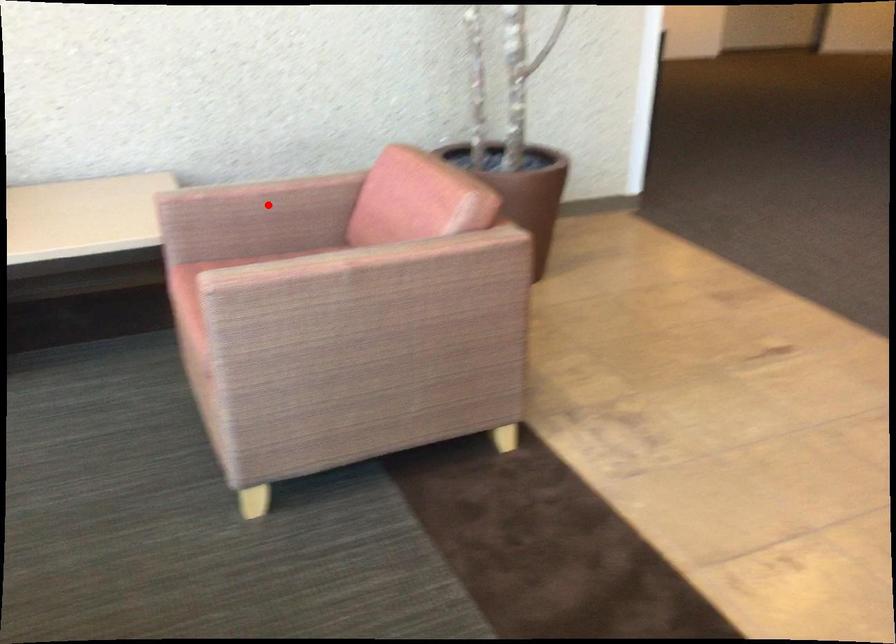
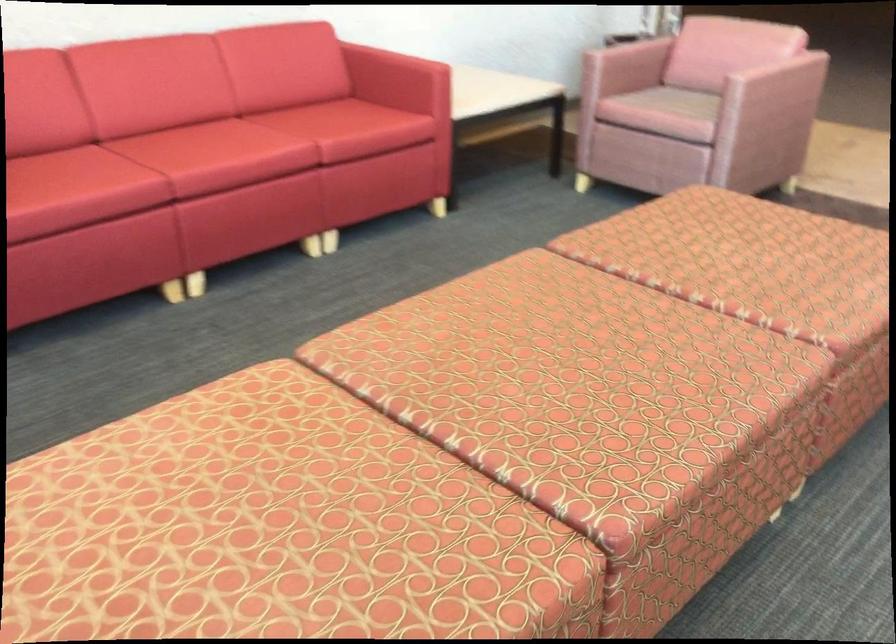
Question: I am providing you with two images of the same scene from different viewpoints. A red point is marked on the first image. At the location where the point appears in image 1, is it still visible in image 2?

Choices:
 (A) Yes
 (B) No

Answer: (A)